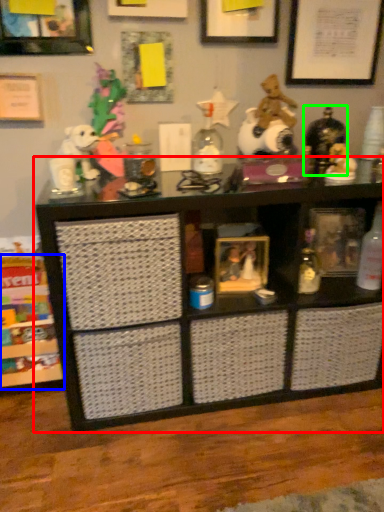
Question: Considering the real-world distances, which object is closest to shelf (highlighted by a red box)? shelf (highlighted by a blue box) or toy (highlighted by a green box).

Choices:
 (A) shelf
 (B) toy

Answer: (A)